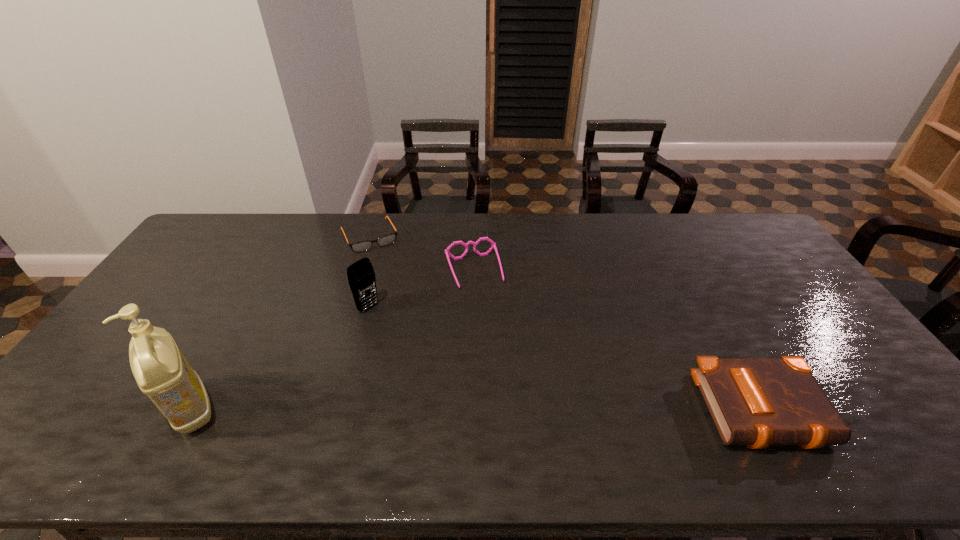
Locate an element on the screen. free space on the desktop that is between the tallest object and the Bible and is positioned on the arms of the second object from right to left is located at coordinates (522, 410).

Find the location of a particular element. Image resolution: width=960 pixels, height=540 pixels. vacant space on the desktop that is between the detergent and the rightmost object and is positioned on the front-facing side of the shortest object is located at coordinates (454, 410).

Find the location of a particular element. free space on the desktop that is between the detergent and the Bible and is positioned on the screen of the second tallest object is located at coordinates (500, 410).